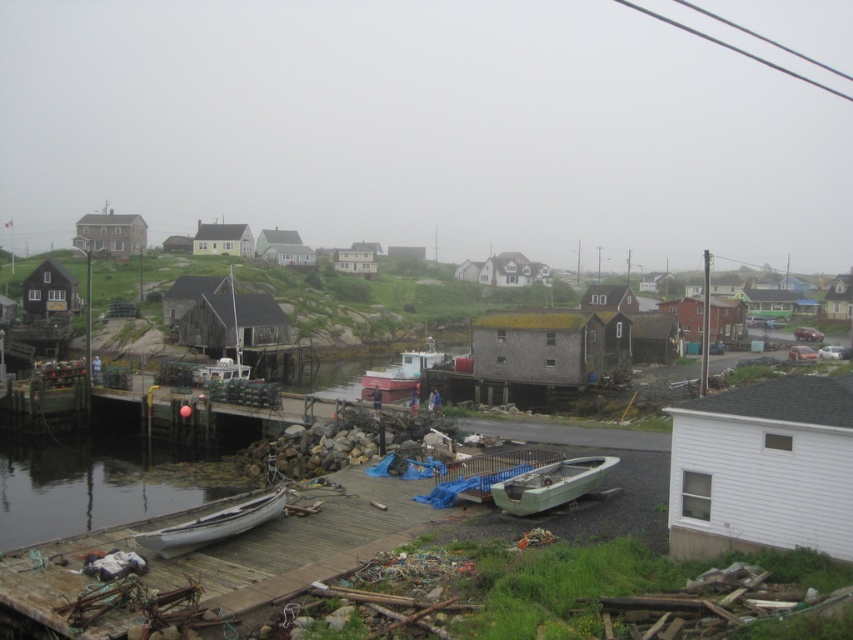
Question: Which of the following is the farthest from the observer?

Choices:
 (A) wooden dock at lower left
 (B) white wooden canoe at lower left

Answer: (B)

Question: Among these points, which one is farthest from the camera?

Choices:
 (A) (579, 468)
 (B) (346, 547)
 (C) (410, 355)
 (D) (125, 435)

Answer: (C)

Question: From the image, what is the correct spatial relationship of white wooden canoe at lower left in relation to red matte boat at center?

Choices:
 (A) below
 (B) above

Answer: (A)

Question: Can you confirm if wooden dock at lower left is positioned to the right of white wooden canoe at lower left?

Choices:
 (A) yes
 (B) no

Answer: (A)

Question: Which point appears farthest from the camera in this image?

Choices:
 (A) (537, 508)
 (B) (167, 536)

Answer: (A)

Question: Can you confirm if clear water at dock left is positioned below red matte boat at center?

Choices:
 (A) no
 (B) yes

Answer: (B)